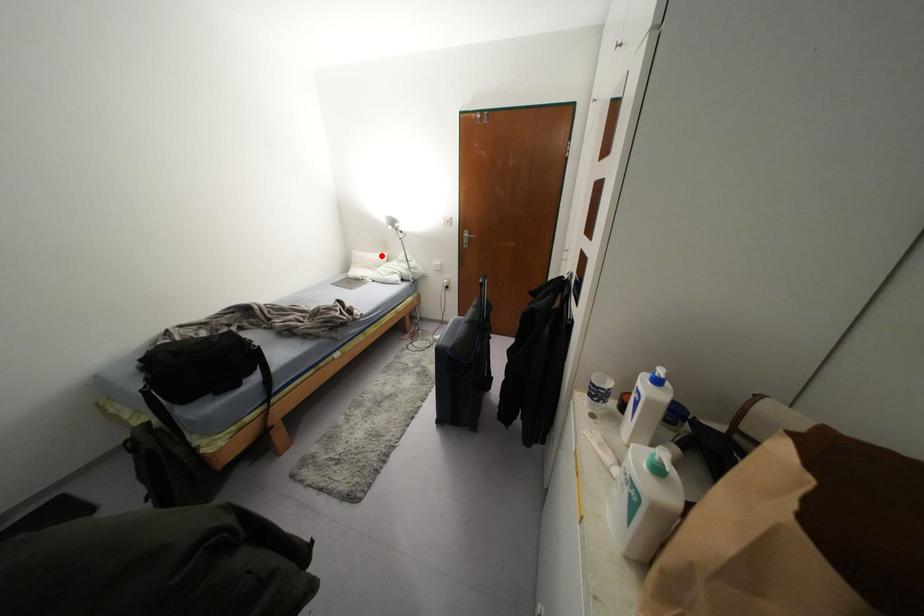
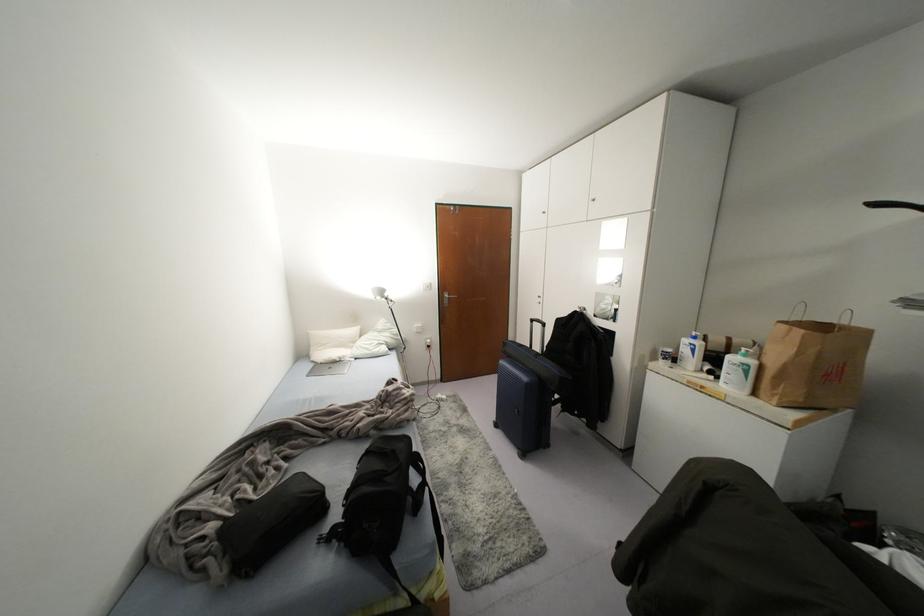
Question: I am providing you with two images of the same scene from different viewpoints. In image1, a red point is highlighted. Considering the same 3D point in image2, which of the following is correct?

Choices:
 (A) It is closer
 (B) It is farther

Answer: (B)